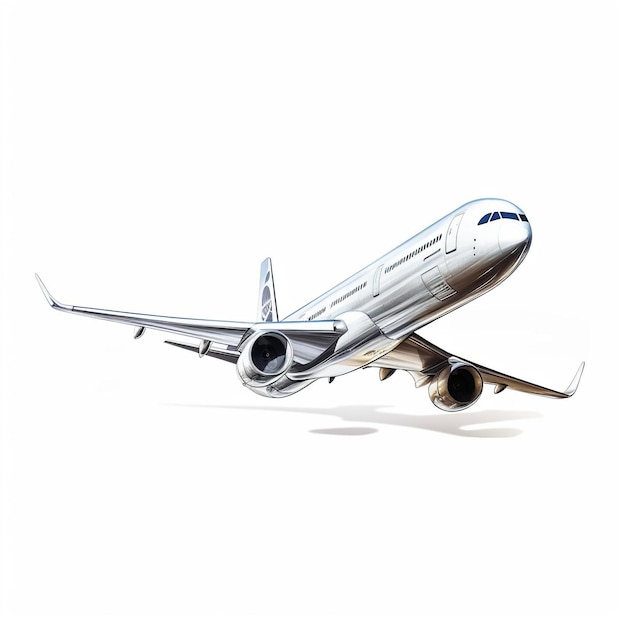
The height and width of the screenshot is (626, 626). In order to click on front windows in this screenshot , I will do click(484, 221), click(495, 217), click(511, 217), click(521, 218).